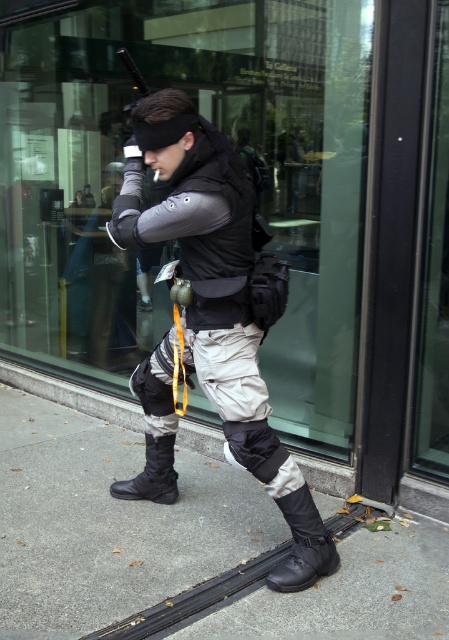
Is black leather boot at lower center behind black matte boot at lower left?

No, black leather boot at lower center is in front of black matte boot at lower left.

Which is behind, point (295, 556) or point (166, 499)?

The point (166, 499) is more distant.

The image size is (449, 640). I want to click on black leather boot at lower center, so click(x=303, y=545).

How distant is transparent glass at center from matte black vest at center?

They are 1.42 meters apart.

Is transparent glass at center taller than matte black vest at center?

Yes, transparent glass at center is taller than matte black vest at center.

Which is in front, point (157, 269) or point (302, 554)?

Point (302, 554) is more forward.

Find the location of a particular element. The height and width of the screenshot is (640, 449). transparent glass at center is located at coordinates (171, 243).

Is transparent glass at center below black leather boot at lower center?

No.

Is transparent glass at center above black leather boot at lower center?

Yes.

Which is in front, point (170, 60) or point (321, 525)?

Point (321, 525) is in front.

Locate an element on the screen. This screenshot has height=640, width=449. transparent glass at center is located at coordinates (171, 243).